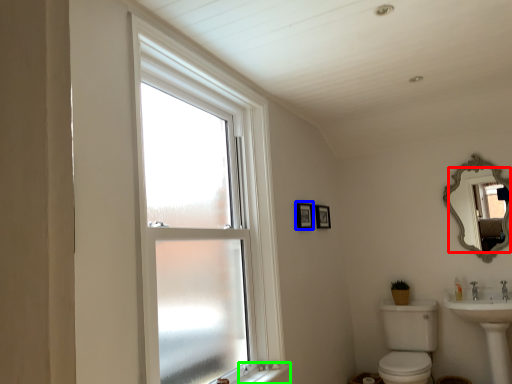
Question: Which is farther away from mirror (highlighted by a red box)? picture frame (highlighted by a blue box) or window sill (highlighted by a green box)?

Choices:
 (A) picture frame
 (B) window sill

Answer: (B)